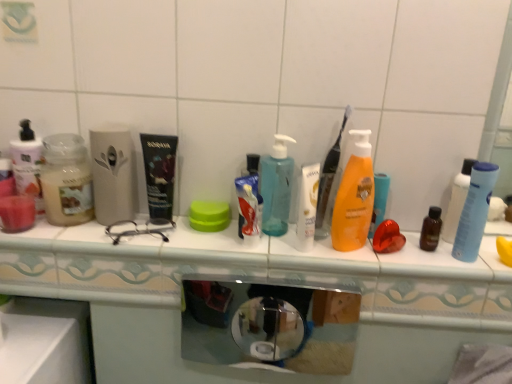
This screenshot has width=512, height=384. I want to click on free space that is in between dark blue plastic tube at center and white glossy toothpaste at center, so click(x=202, y=238).